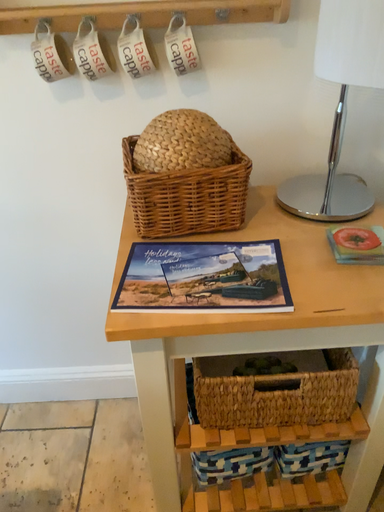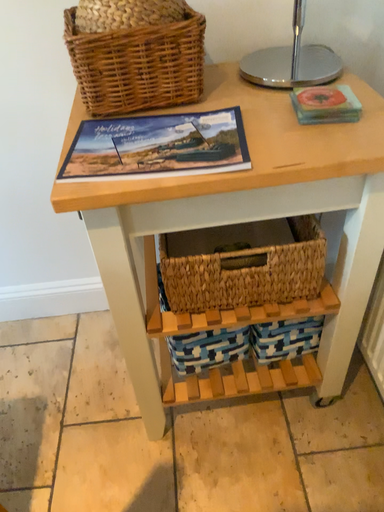
Question: Which way did the camera rotate in the video?

Choices:
 (A) rotated downward
 (B) rotated upward

Answer: (A)